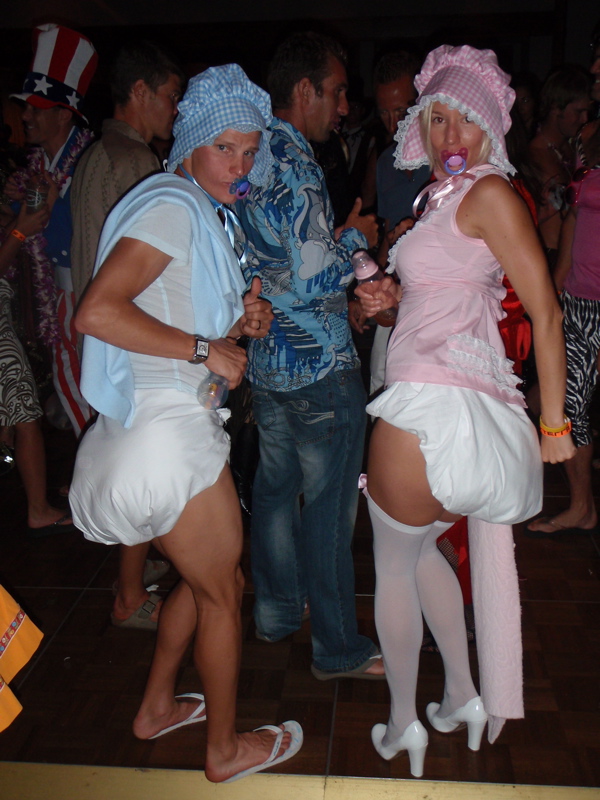
Where is `floor`? Image resolution: width=600 pixels, height=800 pixels. floor is located at coordinates (326, 745).